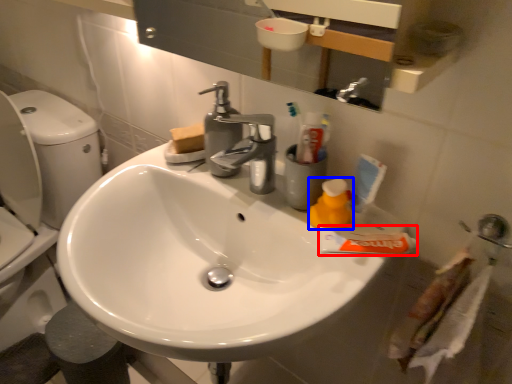
Question: Among these objects, which one is farthest to the camera, toothpaste (highlighted by a red box) or cleaning product (highlighted by a blue box)?

Choices:
 (A) toothpaste
 (B) cleaning product

Answer: (B)